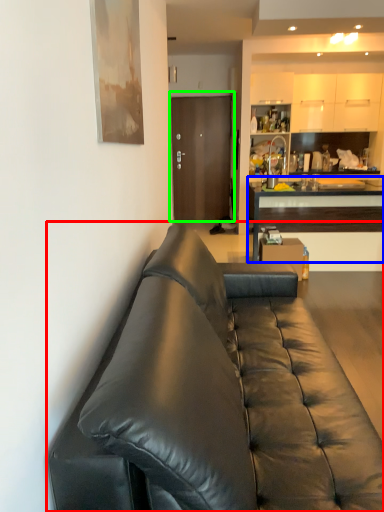
Question: Considering the real-world distances, which object is closest to studio couch (highlighted by a red box)? cabinetry (highlighted by a blue box) or door (highlighted by a green box).

Choices:
 (A) cabinetry
 (B) door

Answer: (A)